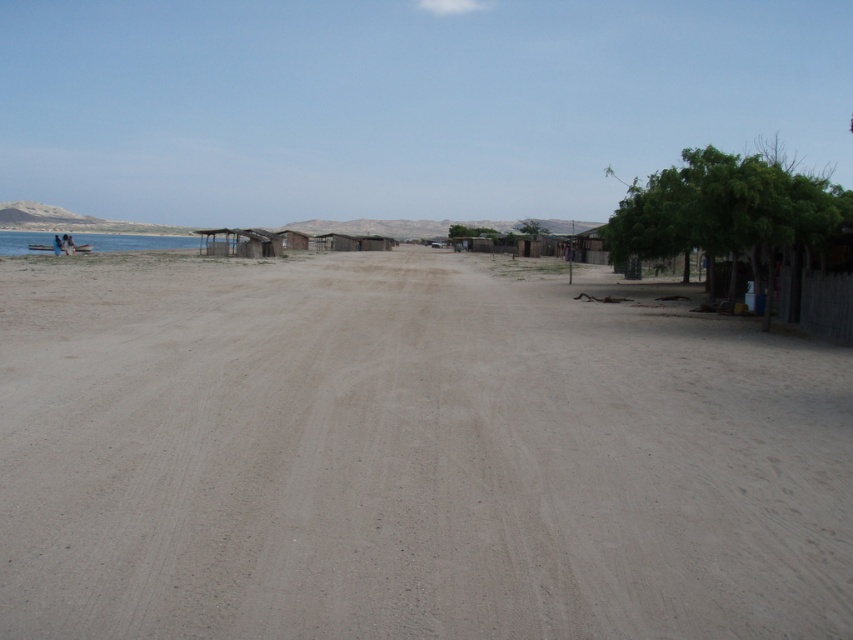
Does dull brown dirt field at center appear under blue water at left?

Correct, dull brown dirt field at center is located below blue water at left.

Is dull brown dirt field at center wider than blue water at left?

No.

Which is in front, point (15, 413) or point (7, 253)?

Positioned in front is point (15, 413).

Find the location of a particular element. The image size is (853, 640). dull brown dirt field at center is located at coordinates (408, 456).